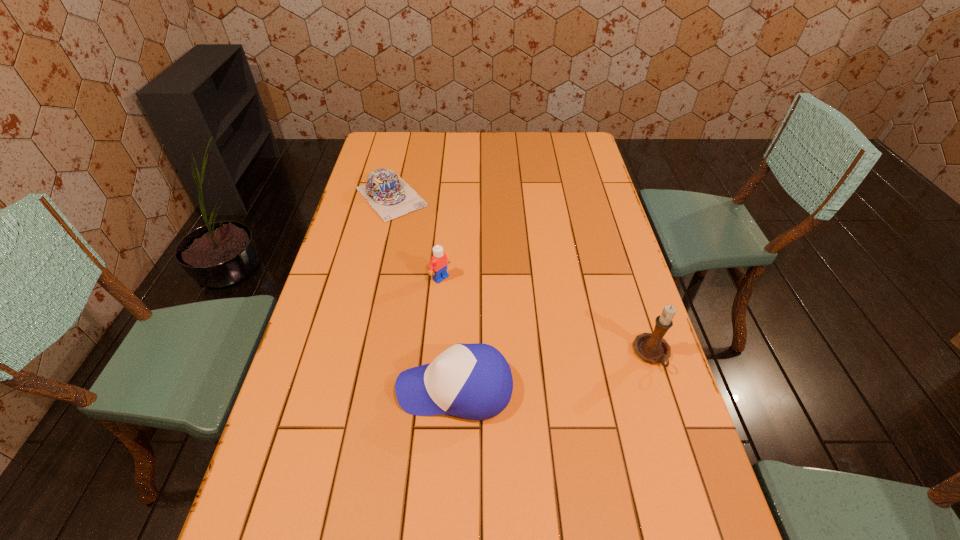
Identify the location of free space on the desktop that is between the baseball cap and the candle holder and is positioned on the face of the Lego. (562, 370).

You are a GUI agent. You are given a task and a screenshot of the screen. Output one action in this format:
    pyautogui.click(x=<x>, y=<y>)
    Task: Click on the vacant space on the desktop that is between the baseball cap and the tallest object and is positioned on the front, side, and top of the shortest object
    Image resolution: width=960 pixels, height=540 pixels.
    Given the screenshot: What is the action you would take?
    pyautogui.click(x=553, y=372)